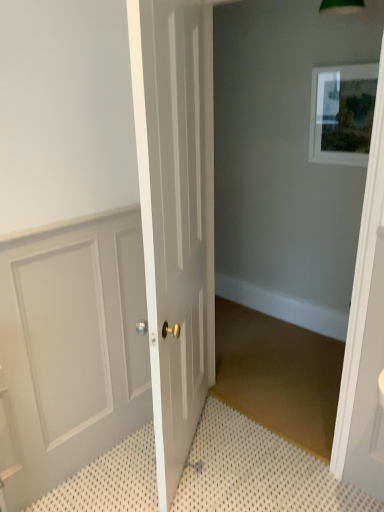
Question: In the image, is white panelled door at left, marked as the second door in a right-to-left arrangement, on the left side or the right side of white textured bath mat at lower left?

Choices:
 (A) left
 (B) right

Answer: (A)

Question: Is white panelled door at left, positioned as the first door in left-to-right order, taller or shorter than white textured bath mat at lower left?

Choices:
 (A) tall
 (B) short

Answer: (A)

Question: Which object is the closest to the white panelled door at left, marked as the second door in a right-to-left arrangement?

Choices:
 (A) white textured bath mat at lower left
 (B) matte white picture frame at upper right
 (C) white glossy door at center, the second door positioned from the left

Answer: (C)

Question: Estimate the real-world distances between objects in this image. Which object is farther from the white panelled door at left, marked as the second door in a right-to-left arrangement?

Choices:
 (A) white textured bath mat at lower left
 (B) white glossy door at center, the second door positioned from the left
 (C) matte white picture frame at upper right

Answer: (C)